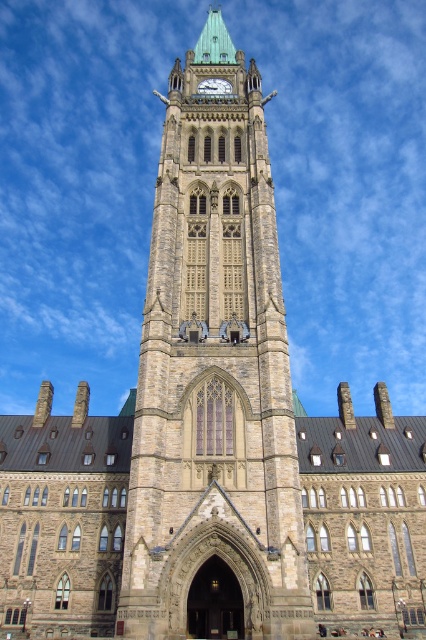
You are standing in front of the grand architectural structure and want to take a photo that includes both the brown stone clock tower at center and the gold metallic clock at center. Which object should you focus on first to ensure both are in clear view?

You should focus on the brown stone clock tower at center first because it is closer to you than the gold metallic clock at center, ensuring both are in clear view when focused on the closer object.

You are standing in front of the grand architectural structure and notice the brown stone clock tower at center and the gold metallic clock at center. Which object is positioned to the left when viewed from your perspective?

The brown stone clock tower at center is positioned to the left of the gold metallic clock at center when viewed from your perspective.

You are an architect designing a new building and want to ensure that the brown stone clock tower at center is visually dominant over the gold metallic clock at center. Based on the scene description, does the current design achieve this goal?

Yes, the brown stone clock tower at center has a greater height compared to the gold metallic clock at center, making it visually dominant in the scene.